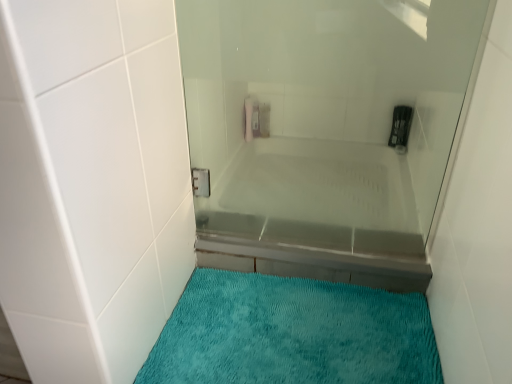
Question: Are transparent glass shower door at center and clear glass bathtub at center beside each other?

Choices:
 (A) no
 (B) yes

Answer: (B)

Question: Is the position of transparent glass shower door at center less distant than that of clear glass bathtub at center?

Choices:
 (A) no
 (B) yes

Answer: (B)

Question: Is transparent glass shower door at center positioned with its back to clear glass bathtub at center?

Choices:
 (A) no
 (B) yes

Answer: (A)

Question: Is transparent glass shower door at center facing towards clear glass bathtub at center?

Choices:
 (A) yes
 (B) no

Answer: (B)

Question: From the image's perspective, is transparent glass shower door at center located beneath clear glass bathtub at center?

Choices:
 (A) yes
 (B) no

Answer: (B)

Question: In terms of height, does teal plush bath mat at lower center look taller or shorter compared to clear glass bathtub at center?

Choices:
 (A) short
 (B) tall

Answer: (A)

Question: Considering the positions of teal plush bath mat at lower center and clear glass bathtub at center in the image, is teal plush bath mat at lower center bigger or smaller than clear glass bathtub at center?

Choices:
 (A) big
 (B) small

Answer: (B)

Question: Relative to clear glass bathtub at center, is teal plush bath mat at lower center in front or behind?

Choices:
 (A) behind
 (B) front

Answer: (B)

Question: In terms of width, does teal plush bath mat at lower center look wider or thinner when compared to clear glass bathtub at center?

Choices:
 (A) thin
 (B) wide

Answer: (B)

Question: Is clear glass bathtub at center in front of or behind transparent glass shower door at center in the image?

Choices:
 (A) behind
 (B) front

Answer: (A)

Question: Looking at their shapes, would you say clear glass bathtub at center is wider or thinner than transparent glass shower door at center?

Choices:
 (A) thin
 (B) wide

Answer: (B)

Question: Is clear glass bathtub at center to the left or to the right of transparent glass shower door at center in the image?

Choices:
 (A) right
 (B) left

Answer: (A)

Question: Considering the positions of clear glass bathtub at center and transparent glass shower door at center in the image, is clear glass bathtub at center taller or shorter than transparent glass shower door at center?

Choices:
 (A) tall
 (B) short

Answer: (B)

Question: Looking at the image, does transparent glass shower door at center seem bigger or smaller compared to clear glass bathtub at center?

Choices:
 (A) small
 (B) big

Answer: (B)

Question: Is transparent glass shower door at center in front of or behind clear glass bathtub at center in the image?

Choices:
 (A) behind
 (B) front

Answer: (B)